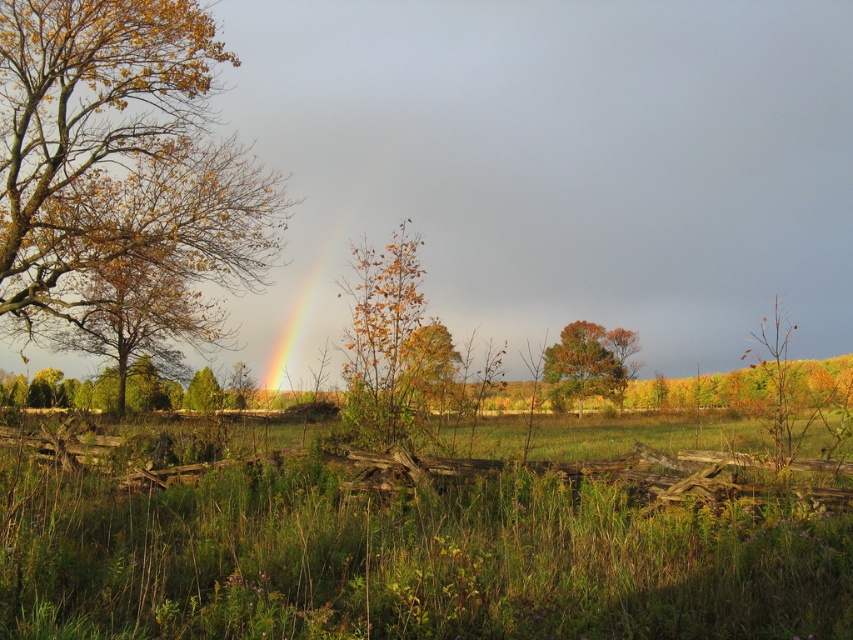
Question: Can you confirm if green grass at center is bigger than orange leafy tree at center?

Choices:
 (A) no
 (B) yes

Answer: (A)

Question: Does orange leafy tree at center have a smaller size compared to rainbow at center?

Choices:
 (A) no
 (B) yes

Answer: (B)

Question: Is rainbow at center positioned before orange-brown foliage at center?

Choices:
 (A) no
 (B) yes

Answer: (A)

Question: Which object is positioned farthest from the golden yellow leaves at center?

Choices:
 (A) green grass at center
 (B) orange leafy tree at center

Answer: (A)

Question: Which object is closer to the camera taking this photo?

Choices:
 (A) rainbow at center
 (B) golden yellow leaves at center

Answer: (B)

Question: Which object is closer to the camera taking this photo?

Choices:
 (A) rainbow at center
 (B) golden-brown bark tree at left
 (C) green grass at center

Answer: (C)